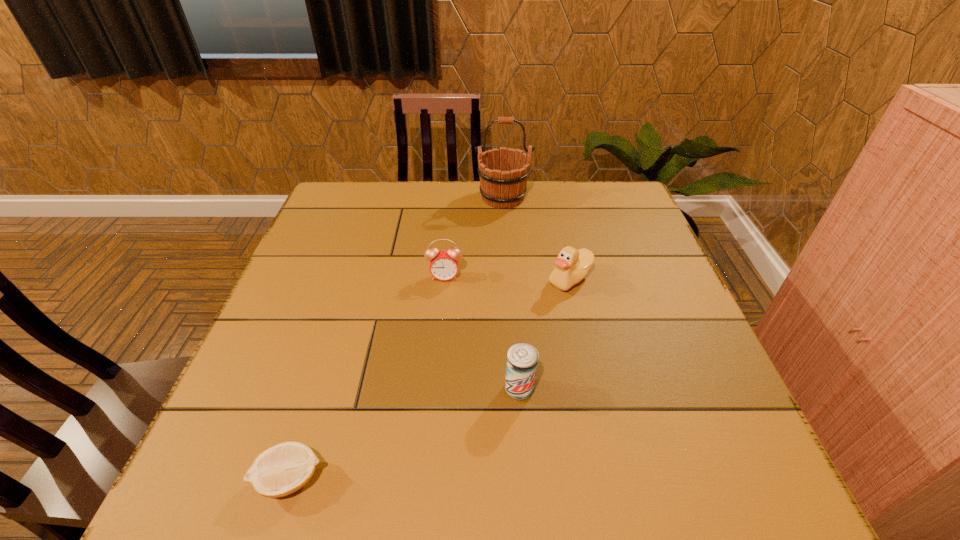
Image resolution: width=960 pixels, height=540 pixels. I want to click on vacant space that satisfies the following two spatial constraints: 1. on the clock face of the beer can; 2. on the left side of the second object from left to right, so click(435, 389).